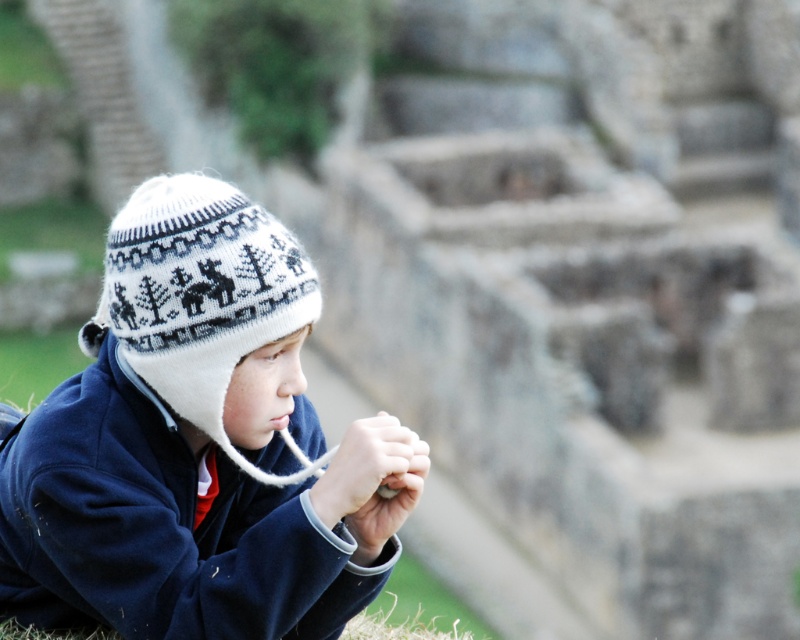
Can you confirm if white knitted hat at center is positioned to the right of white knitted hat at left?

No, white knitted hat at center is not to the right of white knitted hat at left.

Describe the element at coordinates (198, 445) in the screenshot. I see `white knitted hat at center` at that location.

Where is `white knitted hat at center`? white knitted hat at center is located at coordinates (198, 445).